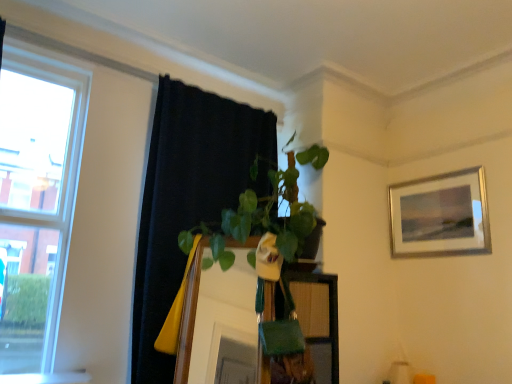
Question: Can you confirm if white glossy window sill at lower left is wider than black fabric curtain at upper left?

Choices:
 (A) no
 (B) yes

Answer: (A)

Question: From the image's perspective, is white glossy window sill at lower left over black fabric curtain at upper left?

Choices:
 (A) yes
 (B) no

Answer: (B)

Question: From the image's perspective, does white glossy window sill at lower left appear lower than black fabric curtain at upper left?

Choices:
 (A) yes
 (B) no

Answer: (A)

Question: From a real-world perspective, is white glossy window sill at lower left over black fabric curtain at upper left?

Choices:
 (A) yes
 (B) no

Answer: (B)

Question: Considering the relative sizes of white glossy window sill at lower left and black fabric curtain at upper left in the image provided, is white glossy window sill at lower left shorter than black fabric curtain at upper left?

Choices:
 (A) no
 (B) yes

Answer: (B)

Question: Does white glossy window sill at lower left have a greater height compared to black fabric curtain at upper left?

Choices:
 (A) no
 (B) yes

Answer: (A)

Question: Is white glossy window sill at lower left not inside wooden mirror at center?

Choices:
 (A) no
 (B) yes

Answer: (B)

Question: Is white glossy window sill at lower left taller than wooden mirror at center?

Choices:
 (A) no
 (B) yes

Answer: (A)

Question: Is there a large distance between white glossy window sill at lower left and wooden mirror at center?

Choices:
 (A) no
 (B) yes

Answer: (A)

Question: Could you tell me if white glossy window sill at lower left is facing wooden mirror at center?

Choices:
 (A) yes
 (B) no

Answer: (B)

Question: Are white glossy window sill at lower left and wooden mirror at center making contact?

Choices:
 (A) yes
 (B) no

Answer: (B)

Question: Can you confirm if white glossy window sill at lower left is wider than wooden mirror at center?

Choices:
 (A) yes
 (B) no

Answer: (B)

Question: Is white glossy window sill at lower left shorter than clear glass window at left?

Choices:
 (A) yes
 (B) no

Answer: (A)